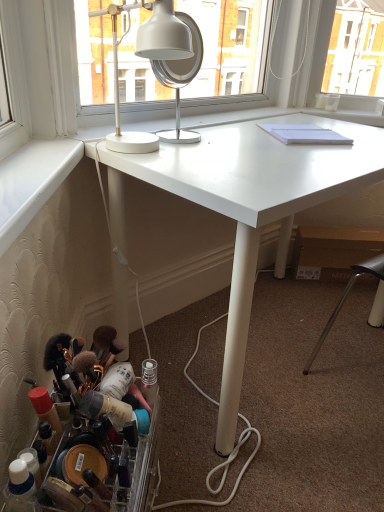
Find the location of a particular element. Image resolution: width=384 pixels, height=512 pixels. free area in between white glossy desk lamp at upper center and white metallic mirror at upper center is located at coordinates (198, 146).